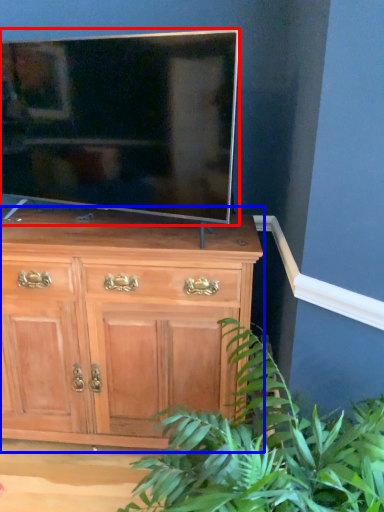
Question: Which object is closer to the camera taking this photo, television (highlighted by a red box) or chest of drawers (highlighted by a blue box)?

Choices:
 (A) television
 (B) chest of drawers

Answer: (A)